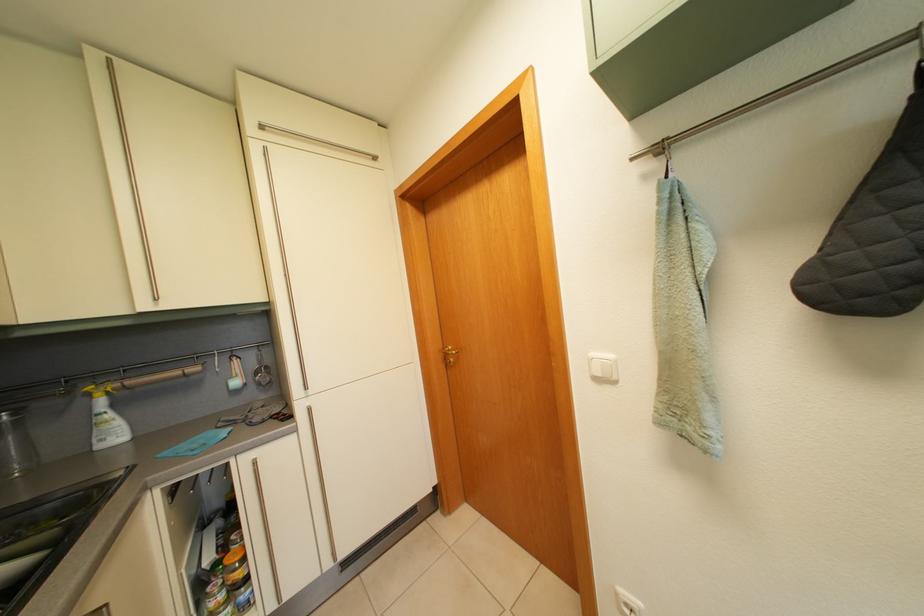
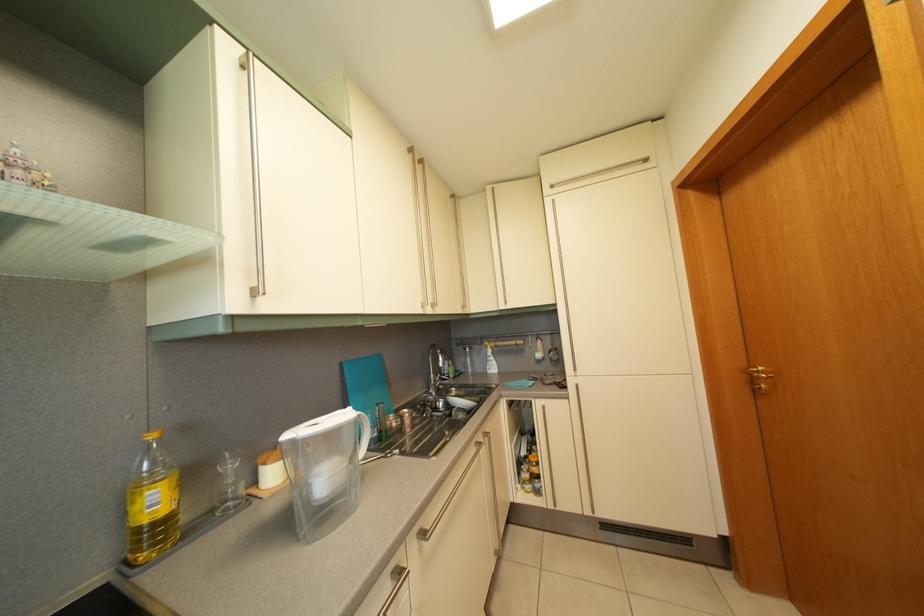
Question: The camera is either moving clockwise (left) or counter-clockwise (right) around the object. The first image is from the beginning of the video and the second image is from the end. Is the camera moving left or right when shooting the video?

Choices:
 (A) Left
 (B) Right

Answer: (B)